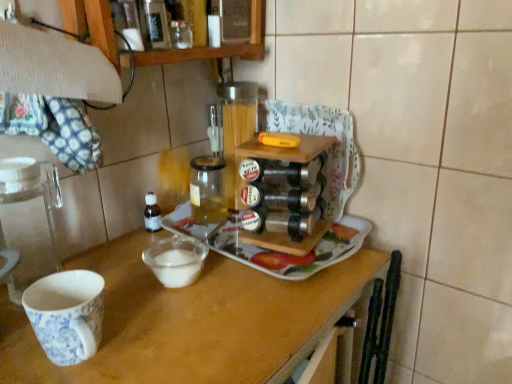
The height and width of the screenshot is (384, 512). I want to click on vacant area on top of wooden table at center (from a real-world perspective), so click(216, 290).